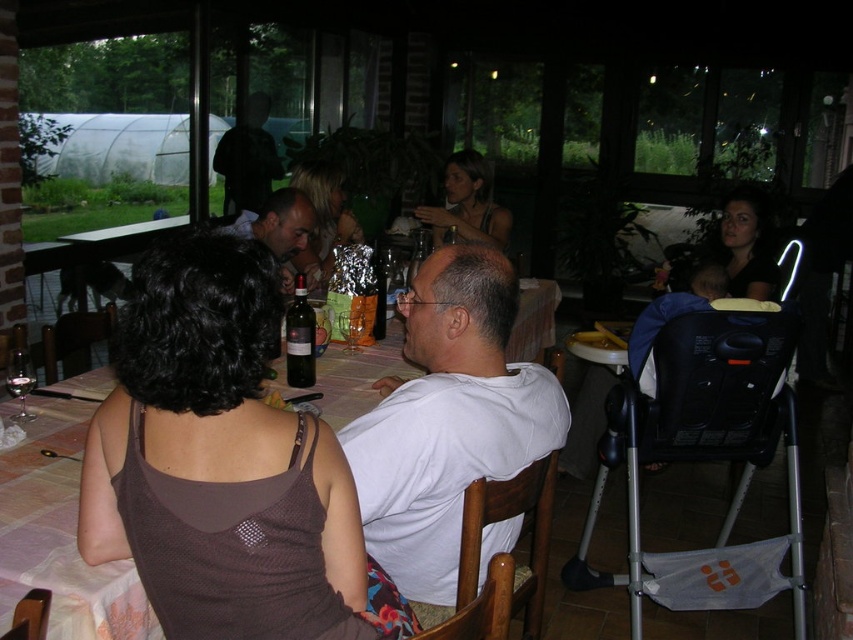
Question: Can you confirm if shiny silver foil at center is bigger than dark glass bottle at table center?

Choices:
 (A) yes
 (B) no

Answer: (A)

Question: Does plaid fabric table at center appear over shiny silver foil at center?

Choices:
 (A) no
 (B) yes

Answer: (A)

Question: Based on their relative distances, which object is farther from the matte brown hair at center?

Choices:
 (A) matte black shirt at center
 (B) shiny silver foil at center

Answer: (A)

Question: Can you confirm if plaid fabric table at center is thinner than matte black shirt at center?

Choices:
 (A) yes
 (B) no

Answer: (B)

Question: Among these objects, which one is nearest to the camera?

Choices:
 (A) plaid fabric table at center
 (B) white cotton shirt at center
 (C) shiny silver foil at center

Answer: (A)

Question: Which object is closer to the camera taking this photo?

Choices:
 (A) white cotton shirt at center
 (B) dark glass bottle at table center

Answer: (A)